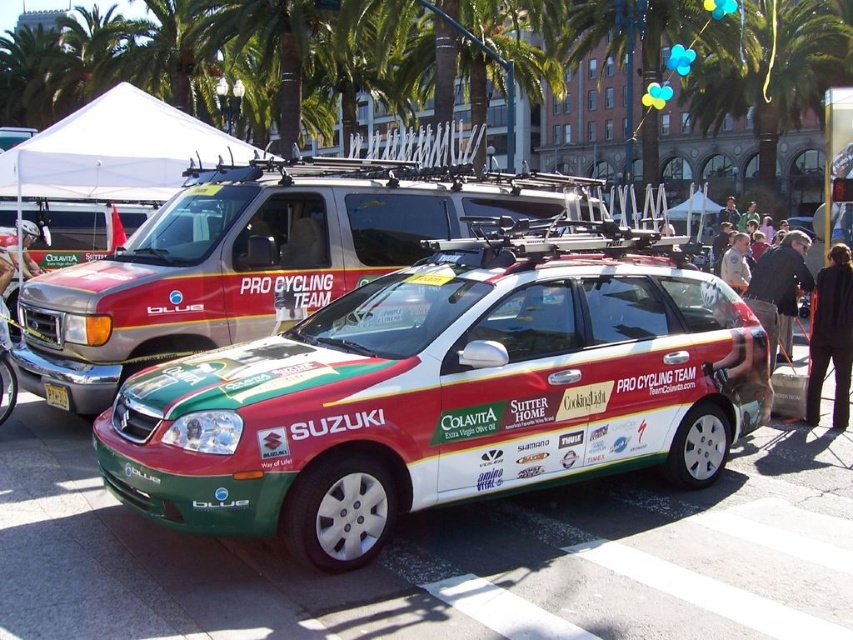
Looking at this image, does black fabric pants at lower right have a lesser height compared to yellow plastic license plate at center?

No, black fabric pants at lower right is not shorter than yellow plastic license plate at center.

Which is behind, point (837, 342) or point (57, 401)?

The point (837, 342) is more distant.

Find the location of a particular element. black fabric pants at lower right is located at coordinates (831, 336).

Is green matte car at center further to the viewer compared to light brown leather jacket at upper right?

No, it is in front of light brown leather jacket at upper right.

Who is more distant from viewer, (x=125, y=269) or (x=740, y=244)?

The point (x=740, y=244) is more distant.

Is point (550, 189) more distant than point (732, 280)?

No, (550, 189) is in front of (732, 280).

At what (x,y) coordinates should I click in order to perform the action: click on green matte car at center. Please return your answer as a coordinate pair (x, y). The image size is (853, 640). Looking at the image, I should click on (254, 259).

What do you see at coordinates (445, 394) in the screenshot? This screenshot has width=853, height=640. I see `green matte suzuki car at center` at bounding box center [445, 394].

Who is lower down, green matte suzuki car at center or white fabric canopy at upper center?

green matte suzuki car at center

Is point (370, 408) in front of point (62, 144)?

Yes, point (370, 408) is closer to viewer.

Identify the location of green matte suzuki car at center. (445, 394).